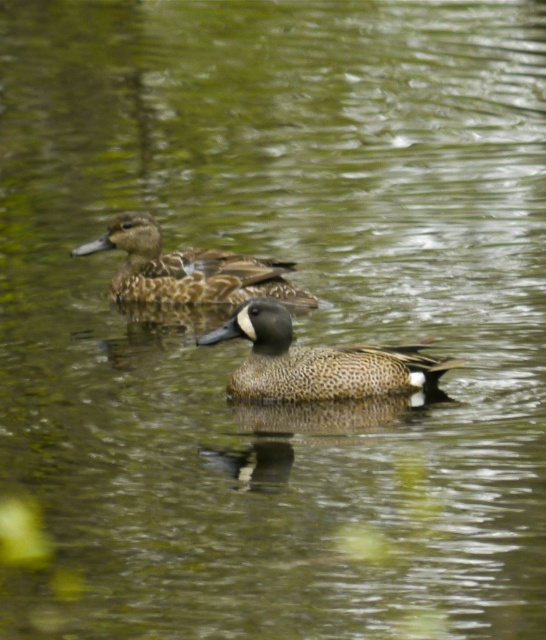
Question: Which of the following is the closest to the observer?

Choices:
 (A) (207, 278)
 (B) (245, 362)

Answer: (B)

Question: Does speckled feathered duck at center appear over brown speckled duck at upper center?

Choices:
 (A) yes
 (B) no

Answer: (B)

Question: Can you confirm if speckled feathered duck at center is positioned to the left of brown speckled duck at upper center?

Choices:
 (A) no
 (B) yes

Answer: (A)

Question: Is speckled feathered duck at center to the left of brown speckled duck at upper center from the viewer's perspective?

Choices:
 (A) no
 (B) yes

Answer: (A)